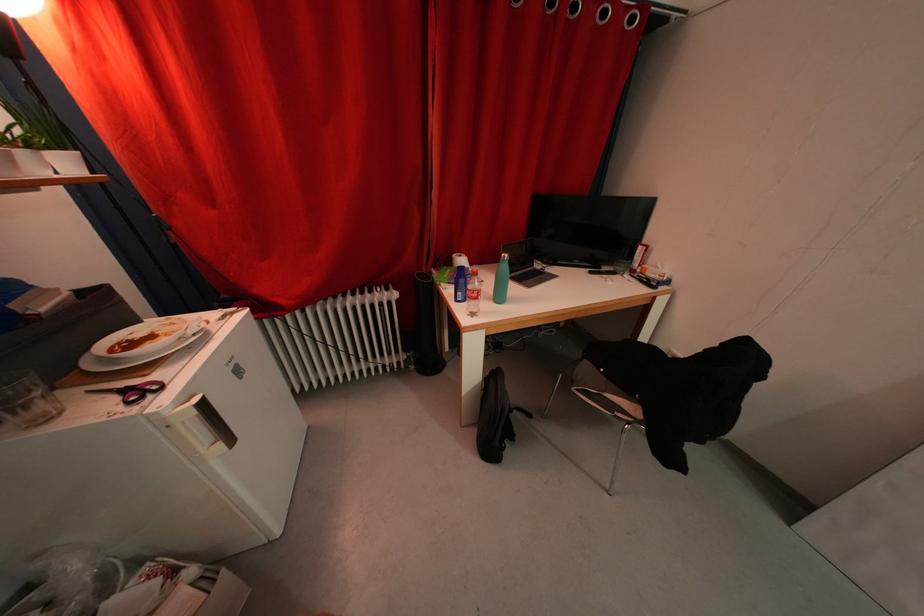
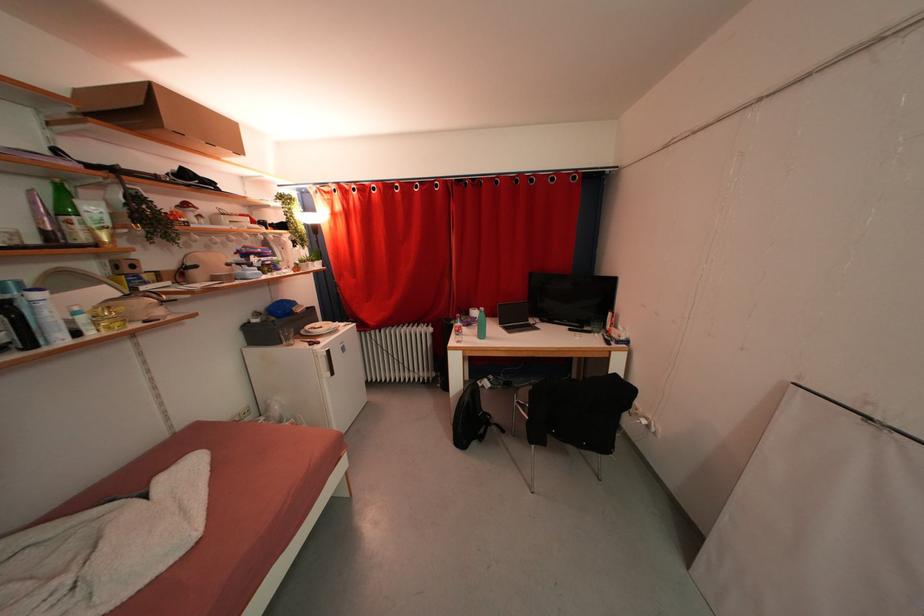
Locate, in the second image, the point that corresponds to point (400, 299) in the first image.

(436, 333)